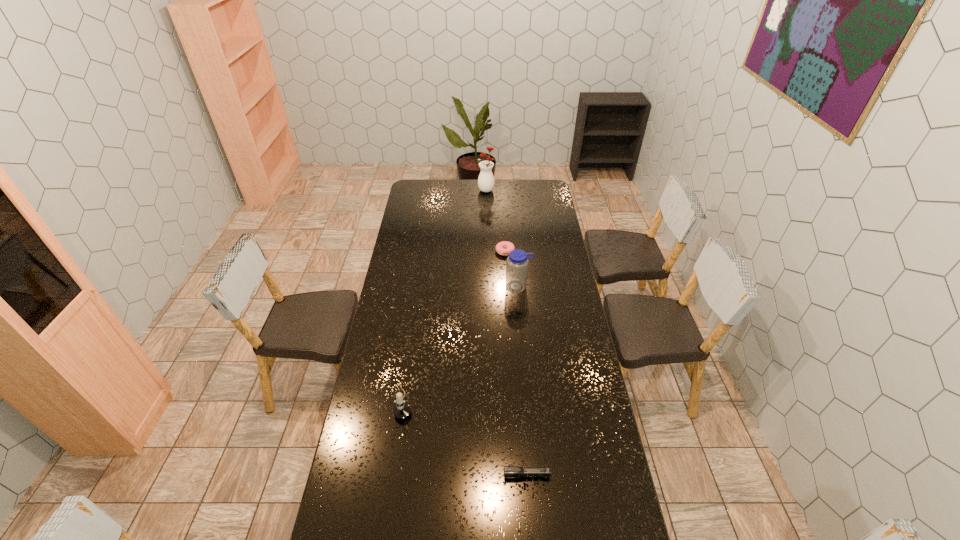
You are a GUI agent. You are given a task and a screenshot of the screen. Output one action in this format:
    pyautogui.click(x=<x>, y=<y>)
    Task: Click on the object identified as the closest to the second farthest object
    This screenshot has width=960, height=540.
    Given the screenshot: What is the action you would take?
    pyautogui.click(x=517, y=262)

I want to click on free location that satisfies the following two spatial constraints: 1. on the back side of the leftmost object; 2. on the right side of the vase, so click(x=435, y=190).

Find the location of a particular element. vacant area in the image that satisfies the following two spatial constraints: 1. with a carrying loop on the side of the third farthest object; 2. at the lens end of the nearest object is located at coordinates (536, 475).

Locate an element on the screen. This screenshot has height=540, width=960. free spot that satisfies the following two spatial constraints: 1. on the back side of the microphone; 2. on the right side of the farthest object is located at coordinates (435, 190).